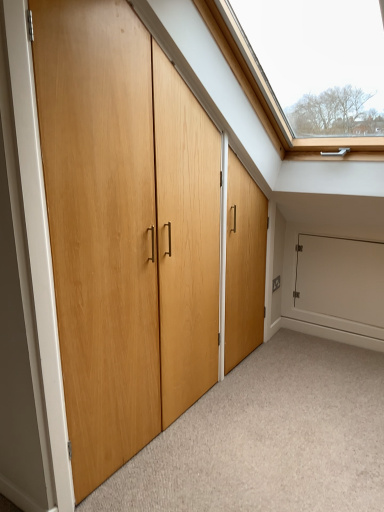
Question: Is natural wood door at center looking in the opposite direction of white matte cabinet at lower right?

Choices:
 (A) yes
 (B) no

Answer: (B)

Question: Is natural wood door at center further to camera compared to white matte cabinet at lower right?

Choices:
 (A) yes
 (B) no

Answer: (B)

Question: Is there a large distance between natural wood door at center and white matte cabinet at lower right?

Choices:
 (A) yes
 (B) no

Answer: (A)

Question: Is natural wood door at center to the left of white matte cabinet at lower right from the viewer's perspective?

Choices:
 (A) no
 (B) yes

Answer: (B)

Question: From the image's perspective, is natural wood door at center on top of white matte cabinet at lower right?

Choices:
 (A) no
 (B) yes

Answer: (B)

Question: Does point (352, 300) appear closer or farther from the camera than point (124, 247)?

Choices:
 (A) closer
 (B) farther

Answer: (B)

Question: Is white matte cabinet at lower right bigger or smaller than natural wood door at center?

Choices:
 (A) big
 (B) small

Answer: (B)

Question: In the image, is white matte cabinet at lower right positioned in front of or behind natural wood door at center?

Choices:
 (A) front
 (B) behind

Answer: (B)

Question: Is white matte cabinet at lower right wider or thinner than natural wood door at center?

Choices:
 (A) thin
 (B) wide

Answer: (A)

Question: From the image's perspective, is natural wood door at center located above or below white matte cabinet at lower right?

Choices:
 (A) below
 (B) above

Answer: (B)

Question: From a real-world perspective, is natural wood door at center physically located above or below white matte cabinet at lower right?

Choices:
 (A) below
 (B) above

Answer: (B)

Question: Visually, is natural wood door at center positioned to the left or to the right of white matte cabinet at lower right?

Choices:
 (A) left
 (B) right

Answer: (A)

Question: Is natural wood door at center situated inside white matte cabinet at lower right or outside?

Choices:
 (A) inside
 (B) outside

Answer: (B)

Question: Relative to natural wood door at center, is light wood door at center in front or behind?

Choices:
 (A) behind
 (B) front

Answer: (B)

Question: Do you think light wood door at center is within natural wood door at center, or outside of it?

Choices:
 (A) inside
 (B) outside

Answer: (B)